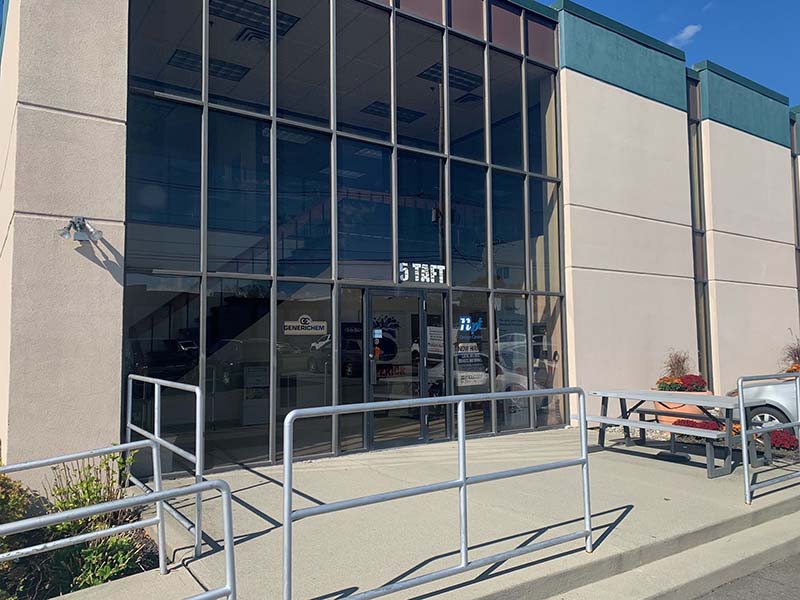
The image size is (800, 600). Find the location of `windows`. windows is located at coordinates (245, 240), (290, 234), (358, 229), (412, 232).